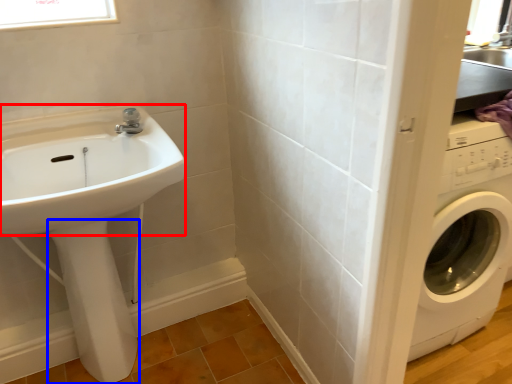
Question: Which object is closer to the camera taking this photo, sink (highlighted by a red box) or bidet (highlighted by a blue box)?

Choices:
 (A) sink
 (B) bidet

Answer: (A)